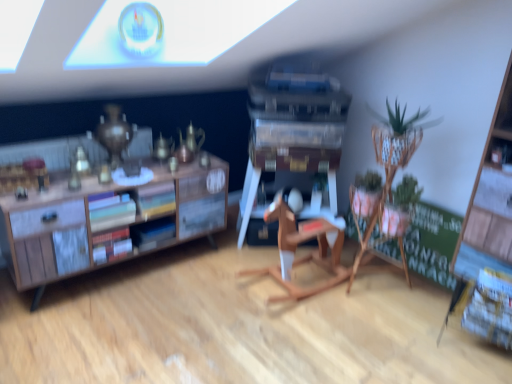
Question: From a real-world perspective, is wooden rocking horse at center below blue matte book at center, positioned as the 2th book in top-to-bottom order?

Choices:
 (A) yes
 (B) no

Answer: (B)

Question: Does wooden rocking horse at center have a greater height compared to blue matte book at center, positioned as the 2th book in top-to-bottom order?

Choices:
 (A) no
 (B) yes

Answer: (B)

Question: From the image's perspective, is wooden rocking horse at center on blue matte book at center, the 1th book when ordered from bottom to top?

Choices:
 (A) no
 (B) yes

Answer: (A)

Question: Is wooden rocking horse at center far away from blue matte book at center, the 1th book when ordered from bottom to top?

Choices:
 (A) yes
 (B) no

Answer: (B)

Question: From the image's perspective, would you say wooden rocking horse at center is shown under blue matte book at center, positioned as the 2th book in top-to-bottom order?

Choices:
 (A) no
 (B) yes

Answer: (B)

Question: Is wooden rocking horse at center completely or partially outside of blue matte book at center, positioned as the 2th book in top-to-bottom order?

Choices:
 (A) yes
 (B) no

Answer: (A)

Question: Is green chalkboard at right turned away from blue matte book at center, positioned as the 2th book in top-to-bottom order?

Choices:
 (A) no
 (B) yes

Answer: (A)

Question: Can blue matte book at center, the 1th book when ordered from bottom to top, be found inside green chalkboard at right?

Choices:
 (A) yes
 (B) no

Answer: (B)

Question: From a real-world perspective, is green chalkboard at right under blue matte book at center, positioned as the 2th book in top-to-bottom order?

Choices:
 (A) yes
 (B) no

Answer: (A)

Question: Can you confirm if green chalkboard at right is shorter than blue matte book at center, the 1th book when ordered from bottom to top?

Choices:
 (A) no
 (B) yes

Answer: (A)

Question: Would you say green chalkboard at right is a long distance from blue matte book at center, the 1th book when ordered from bottom to top?

Choices:
 (A) no
 (B) yes

Answer: (B)

Question: Can you confirm if green chalkboard at right is bigger than blue matte book at center, positioned as the 2th book in top-to-bottom order?

Choices:
 (A) no
 (B) yes

Answer: (B)

Question: Could you tell me if matte hardcover books at center left, placed as the 1th book when sorted from top to bottom, is turned towards green chalkboard at right?

Choices:
 (A) yes
 (B) no

Answer: (B)